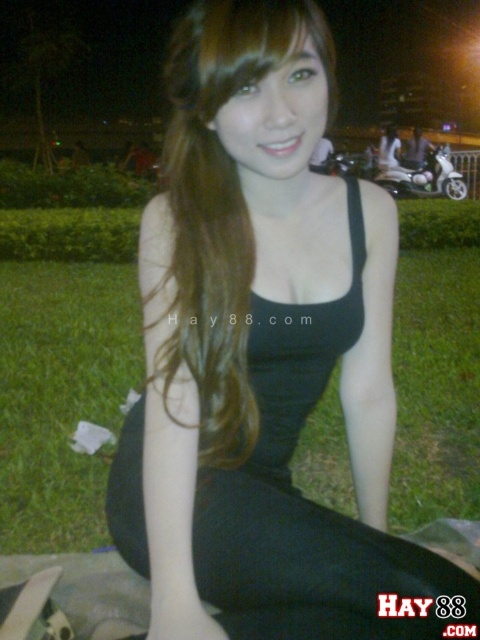
You are planning to walk from the green grass at lower center to the white glossy motorcycle at right in the dark. Considering the distance between them, do you think you can walk directly without needing to navigate around any obstacles?

The green grass at lower center and white glossy motorcycle at right are 15.80 feet apart. Since there are no obstacles mentioned between them, you can walk directly to the motorcycle.

You are organizing a charity event and need to decide which items to display in a small booth. Given the black matte dress at center and the white glossy motorcycle at right, which item would require less space in the booth?

The black matte dress at center has a smaller size compared to the white glossy motorcycle at right, so it would require less space in the booth.

You are taking a photo of the scene and want to focus on both the person and the scooter. The person is at point [313,481] and the scooter is at point [206,305]. Since the camera can only focus on one depth, which point should you choose to ensure the closer object is in focus?

You should focus on point [313,481] because it is further to the camera than point [206,305], so the closer object will be in focus.